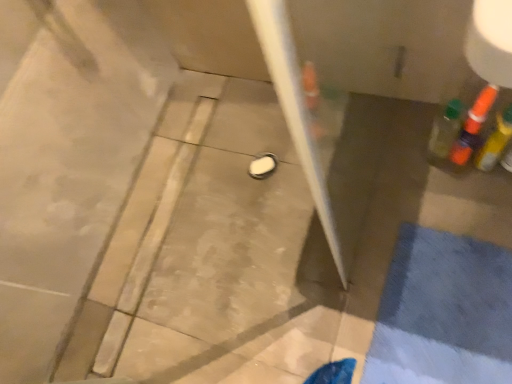
The height and width of the screenshot is (384, 512). I want to click on free space in front of translucent orange bottle at right, arranged as the 3th bottle when viewed from the left, so click(x=498, y=206).